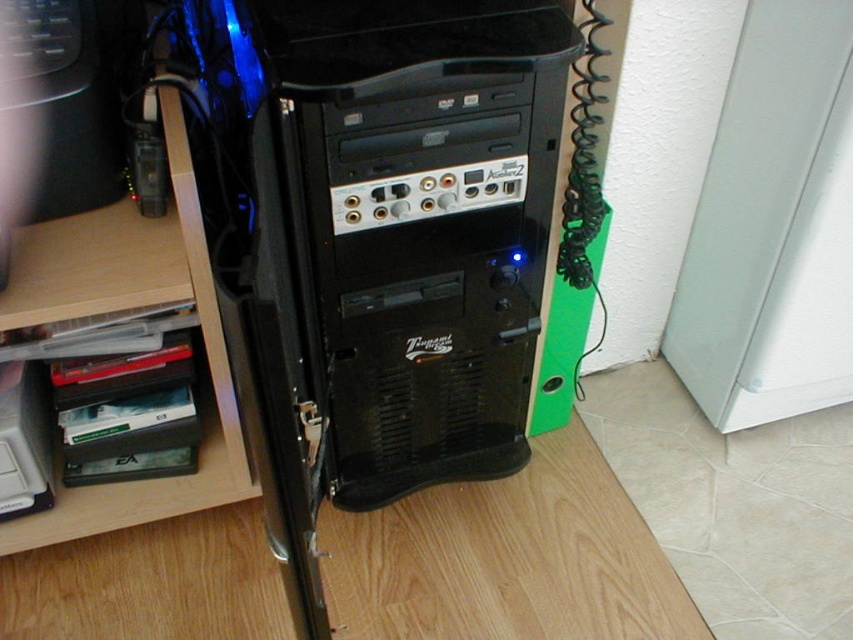
Question: Can you confirm if black plastic computer tower at center is bigger than wooden at left?

Choices:
 (A) yes
 (B) no

Answer: (A)

Question: Is the position of black plastic computer tower at center less distant than that of wooden at left?

Choices:
 (A) yes
 (B) no

Answer: (A)

Question: Among these objects, which one is farthest from the camera?

Choices:
 (A) wooden at left
 (B) black plastic computer tower at center

Answer: (A)

Question: Does black plastic computer tower at center appear over wooden at left?

Choices:
 (A) yes
 (B) no

Answer: (A)

Question: Which point is farther to the camera?

Choices:
 (A) black plastic computer tower at center
 (B) wooden at left

Answer: (B)